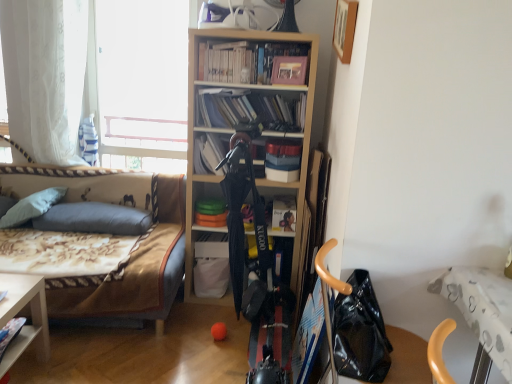
Question: Which direction should I rotate to face matte plastic books at center, which is counted as the 3th book, starting from the bottom, — up or down?

Choices:
 (A) up
 (B) down

Answer: (A)

Question: Can you confirm if black leather handbag at lower right is thinner than light wood bookcase at center?

Choices:
 (A) yes
 (B) no

Answer: (A)

Question: Does black leather handbag at lower right come behind light wood bookcase at center?

Choices:
 (A) no
 (B) yes

Answer: (A)

Question: From a real-world perspective, is black leather handbag at lower right physically above light wood bookcase at center?

Choices:
 (A) yes
 (B) no

Answer: (B)

Question: Considering the relative positions of black leather handbag at lower right and light wood bookcase at center in the image provided, is black leather handbag at lower right to the right of light wood bookcase at center from the viewer's perspective?

Choices:
 (A) yes
 (B) no

Answer: (A)

Question: Considering the relative sizes of black leather handbag at lower right and light wood bookcase at center in the image provided, is black leather handbag at lower right bigger than light wood bookcase at center?

Choices:
 (A) no
 (B) yes

Answer: (A)

Question: Is black leather handbag at lower right at the left side of light wood bookcase at center?

Choices:
 (A) no
 (B) yes

Answer: (A)

Question: Can you confirm if matte black book at center, which ranks as the 3th book in top-to-bottom order, is positioned to the left of wooden picture frame at upper right?

Choices:
 (A) yes
 (B) no

Answer: (A)

Question: From a real-world perspective, is matte black book at center, the second book positioned from the bottom, physically below wooden picture frame at upper right?

Choices:
 (A) yes
 (B) no

Answer: (A)

Question: Is matte black book at center, which ranks as the 3th book in top-to-bottom order, far away from wooden picture frame at upper right?

Choices:
 (A) no
 (B) yes

Answer: (A)

Question: Considering the relative sizes of matte black book at center, the second book positioned from the bottom, and wooden picture frame at upper right in the image provided, is matte black book at center, the second book positioned from the bottom, smaller than wooden picture frame at upper right?

Choices:
 (A) no
 (B) yes

Answer: (B)

Question: Does matte black book at center, the second book positioned from the bottom, turn towards wooden picture frame at upper right?

Choices:
 (A) no
 (B) yes

Answer: (A)

Question: Is matte black book at center, the second book positioned from the bottom, outside of wooden picture frame at upper right?

Choices:
 (A) no
 (B) yes

Answer: (B)

Question: Considering the relative positions of wooden picture frame at upper right and floral fabric couch at left in the image provided, is wooden picture frame at upper right in front of floral fabric couch at left?

Choices:
 (A) no
 (B) yes

Answer: (B)